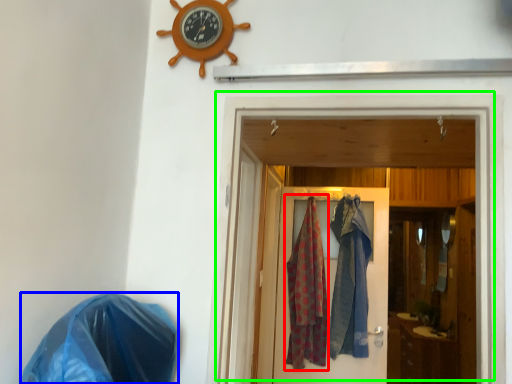
Question: Which is nearer to the clothing (highlighted by a red box)? material (highlighted by a blue box) or door (highlighted by a green box).

Choices:
 (A) material
 (B) door

Answer: (B)